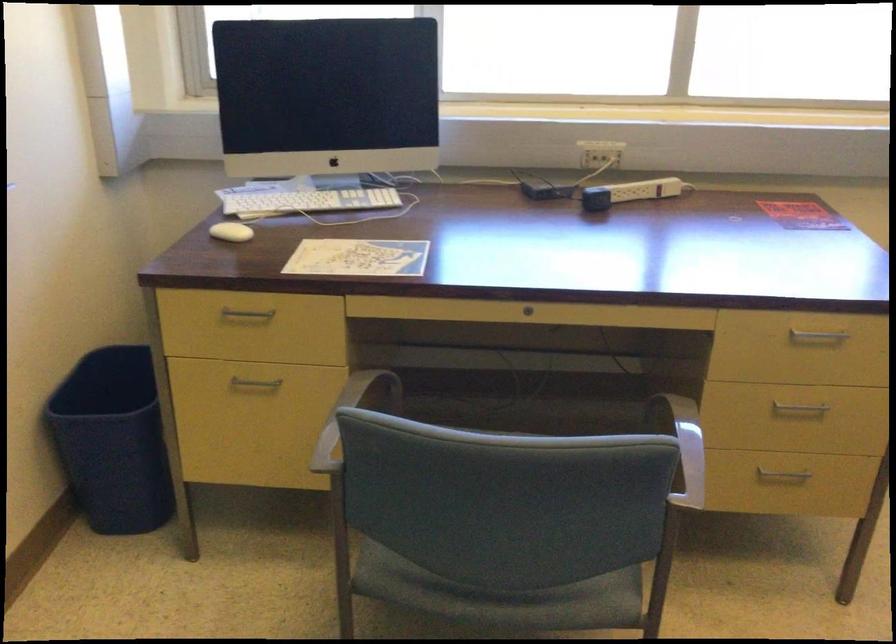
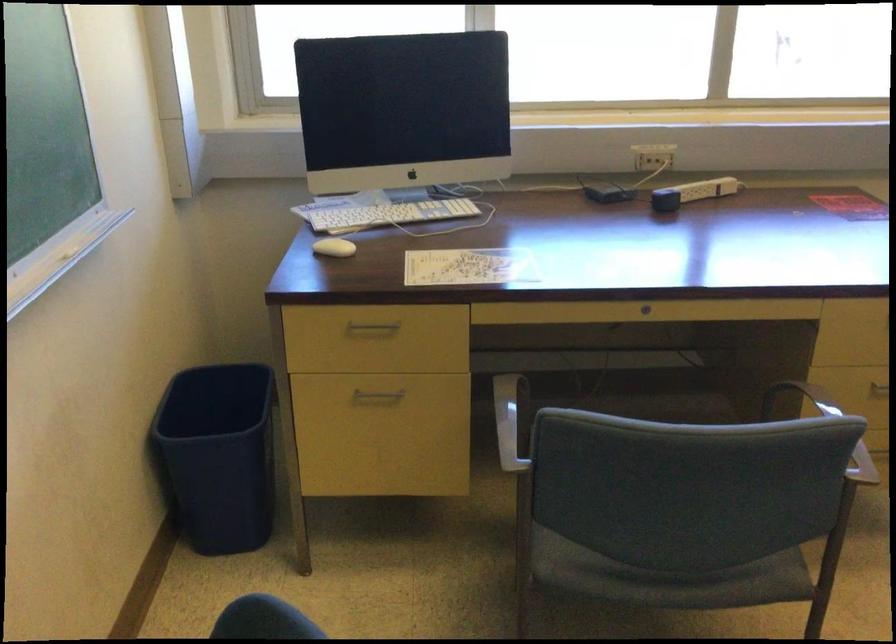
Find the pixel in the second image that matches point (605, 156) in the first image.

(658, 156)